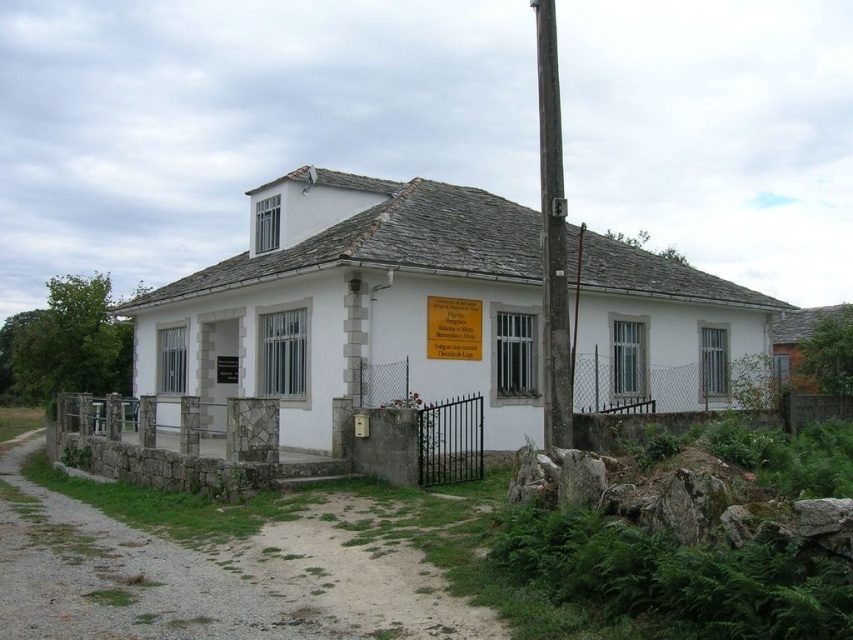
You are a visitor standing in front of the building and want to locate the entrance. You notice a smooth wooden pole at right and a wooden plaque at center. Which object is closer to the ground level?

The wooden plaque at center is closer to the ground level because the smooth wooden pole at right is much taller than it.

You are standing in front of the building and want to locate the entrance. The entrance is to the left of the wooden plaque at center. Which direction should you walk towards the smooth wooden pole at right to find the entrance?

The entrance is to the left of the wooden plaque at center. Since the smooth wooden pole at right is on the right side of the wooden plaque at center, you should walk towards the left of the wooden plaque at center, away from the smooth wooden pole at right, to find the entrance.

You are a delivery person trying to attach a new sign to the building. The new sign requires a support pole that is at least as wide as the existing wooden plaque at center. Can you use the smooth wooden pole at right for this purpose?

The smooth wooden pole at right has a larger width than the wooden plaque at center, so it meets the requirement and can be used to support the new sign.